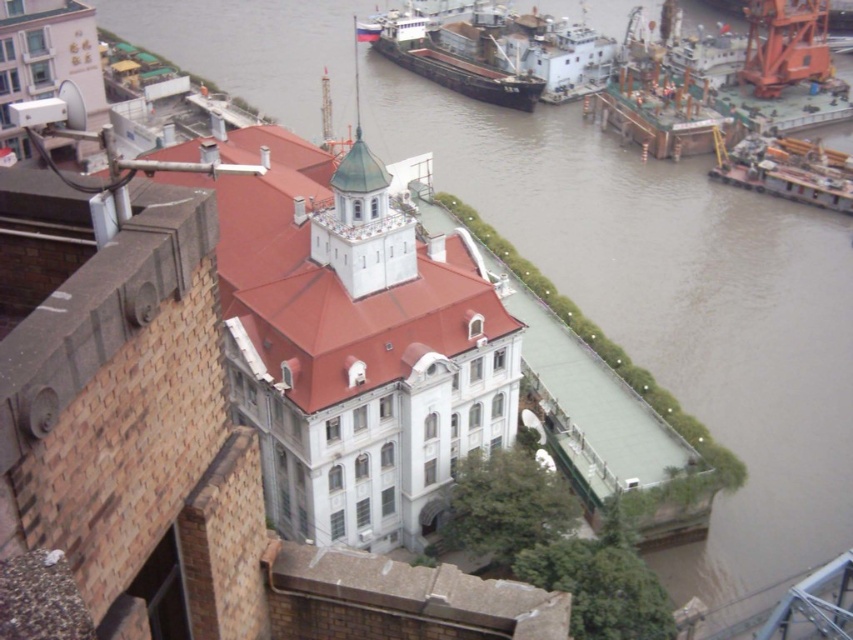
You are a tour guide explaining the river scene to visitors. Pointing to the brown matte cargo ship at upper right and the metallic gray barge at right, you want to describe their positions relative to each other. How would you phrase this?

The brown matte cargo ship at upper right is positioned above the metallic gray barge at right, meaning it is located higher up in the image compared to the barge.

You are a drone operator trying to capture a photo of the brown matte cargo ship at upper right and the metallic gray barge at right. From the perspective of the main building, which vessel is positioned further to the east?

The brown matte cargo ship at upper right is to the left of the metallic gray barge at right. Since the main building is to the west of both vessels, the metallic gray barge at right is positioned further to the east.

You are a photographer planning to capture a photo of the brown matte cargo ship at upper right and the metallic gray barge at right from the building. Considering their heights, which vessel will appear larger in the photo?

The brown matte cargo ship at upper right will appear larger in the photo because it is much taller than the metallic gray barge at right.